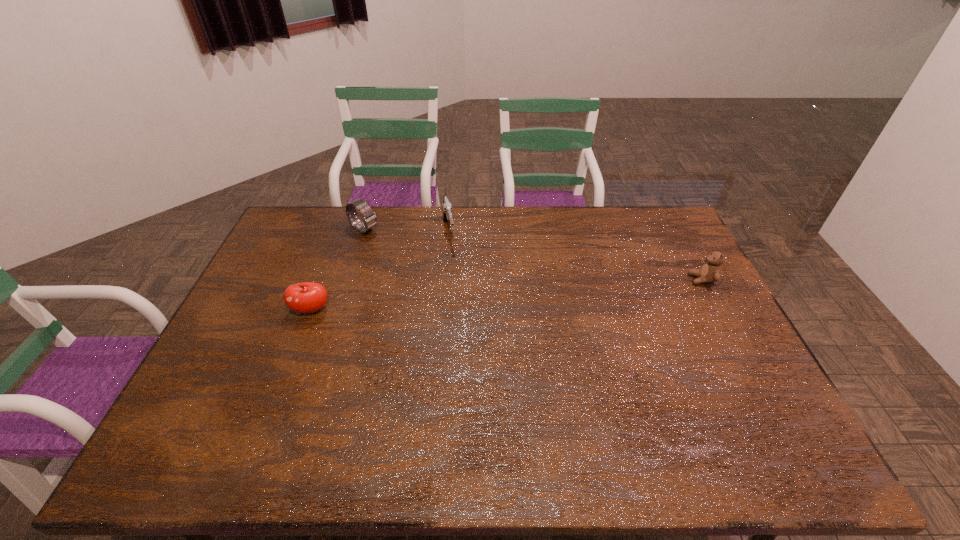
You are a GUI agent. You are given a task and a screenshot of the screen. Output one action in this format:
    pyautogui.click(x=<x>, y=<y>)
    Task: Click on the free spot on the desktop that is between the nearest object and the rightmost object and is positioned at the muzzle of the third object from left to right
    The image size is (960, 540).
    Given the screenshot: What is the action you would take?
    pyautogui.click(x=468, y=298)

Locate an element on the screen. This screenshot has width=960, height=540. free space on the desktop that is between the apple and the rightmost object and is positioned on the face of the watch is located at coordinates (481, 296).